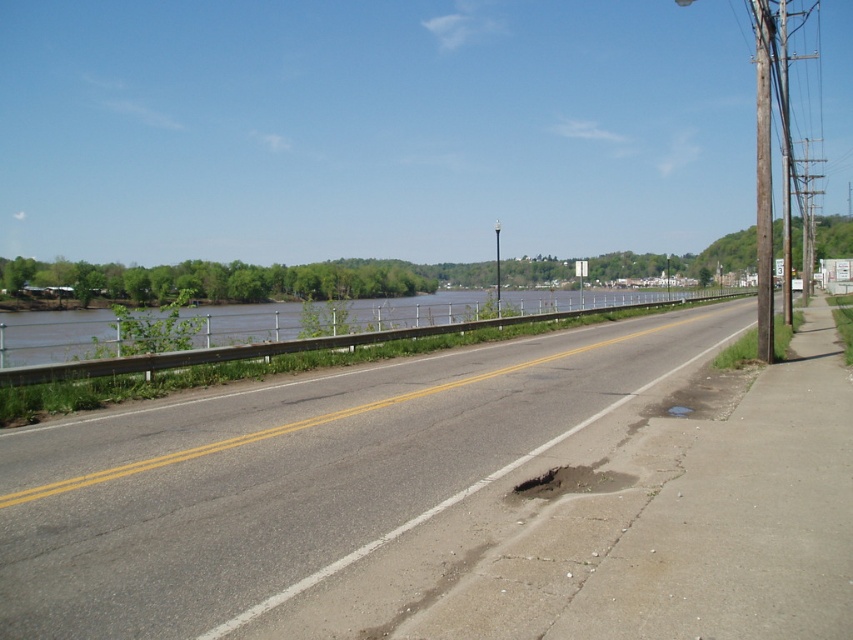
Does asphalt road at center have a lesser width compared to brown water at center?

Yes, asphalt road at center is thinner than brown water at center.

Describe the element at coordinates (293, 476) in the screenshot. This screenshot has width=853, height=640. I see `asphalt road at center` at that location.

Locate an element on the screen. Image resolution: width=853 pixels, height=640 pixels. asphalt road at center is located at coordinates (293, 476).

Looking at this image, which is more to the left, brown water at center or metallic pole at center?

Positioned to the left is brown water at center.

Is point (368, 336) positioned in front of point (497, 234)?

Yes, point (368, 336) is in front of point (497, 234).

Is point (519, 321) closer to viewer compared to point (498, 275)?

That is True.

You are a GUI agent. You are given a task and a screenshot of the screen. Output one action in this format:
    pyautogui.click(x=<x>, y=<y>)
    Task: Click on the brown water at center
    
    Given the screenshot: What is the action you would take?
    pyautogui.click(x=292, y=346)

You are a GUI agent. You are given a task and a screenshot of the screen. Output one action in this format:
    pyautogui.click(x=<x>, y=<y>)
    Task: Click on the asphalt road at center
    
    Given the screenshot: What is the action you would take?
    pyautogui.click(x=293, y=476)

Is asphalt road at center positioned before metallic pole at center?

That is True.

Find the location of a particular element. This screenshot has height=640, width=853. asphalt road at center is located at coordinates (293, 476).

At what (x,y) coordinates should I click in order to perform the action: click on asphalt road at center. Please return your answer as a coordinate pair (x, y). Looking at the image, I should click on (293, 476).